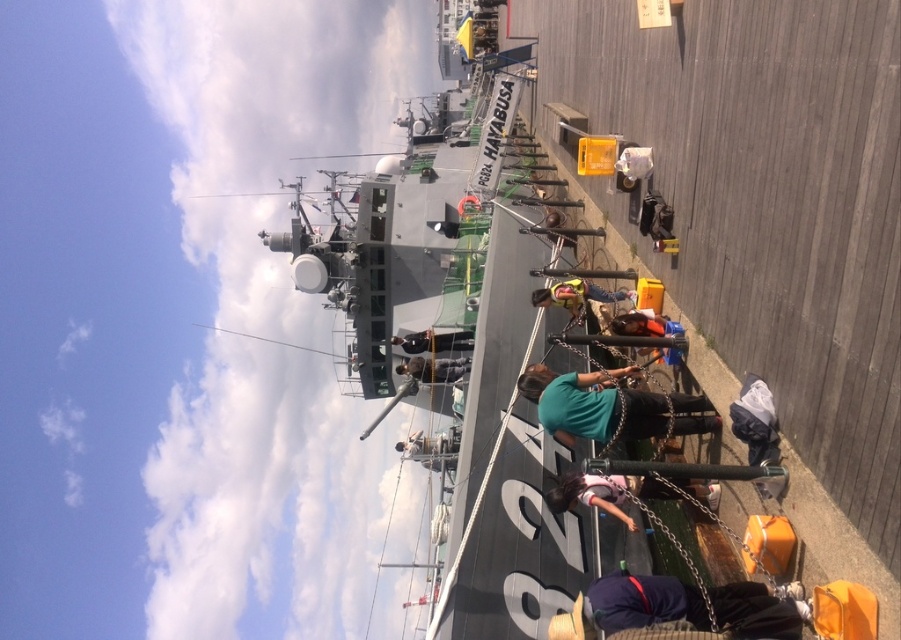
Question: Which object is closer to the camera taking this photo?

Choices:
 (A) dark green uniform at center
 (B) yellow fabric bag at center
 (C) dark blue fabric at lower right

Answer: (C)

Question: Which point is farther from the camera taking this photo?

Choices:
 (A) (626, 577)
 (B) (422, 364)

Answer: (B)

Question: Is teal fabric shirt at center bigger than dark gray uniform at center?

Choices:
 (A) yes
 (B) no

Answer: (A)

Question: Estimate the real-world distances between objects in this image. Which object is farther from the yellow fabric bag at center?

Choices:
 (A) teal fabric shirt at center
 (B) dark green uniform at center

Answer: (B)

Question: In this image, where is pink fabric shirt at lower center located relative to dark gray uniform at center?

Choices:
 (A) left
 (B) right

Answer: (B)

Question: Does teal fabric shirt at center lie in front of dark gray uniform at center?

Choices:
 (A) yes
 (B) no

Answer: (A)